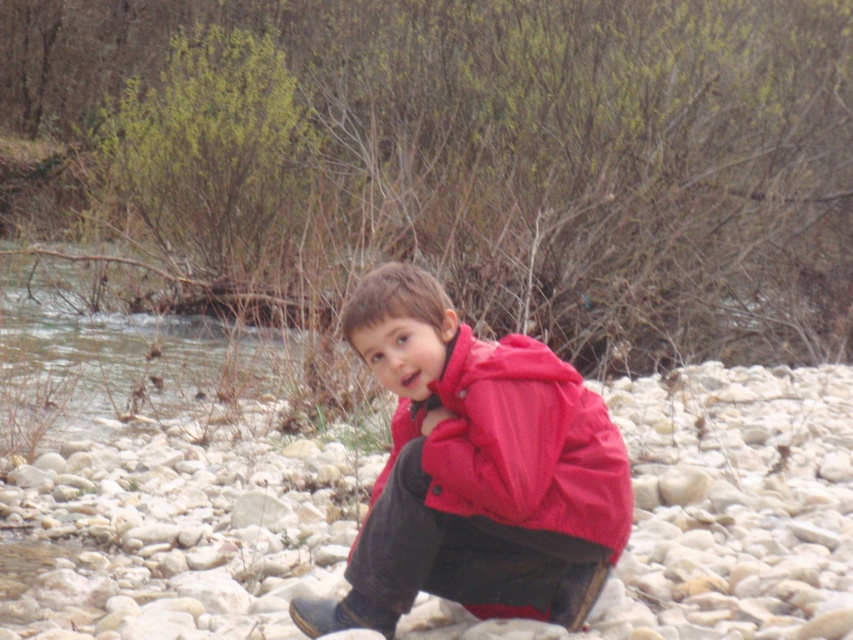
You are navigating a small drone through the scene shown in the image. You need to fly from point A to point B. If point A is at point (659, 448) and point B is at point (398, 451), will you fly over the child or stay above the pebbles?

Point (659, 448) is behind point (398, 451), so flying from point A to point B would mean moving forward towards the camera. Since the child is positioned on the pebbles near the stream, the path from the back to the front would pass above the pebbles and not over the child.

You are a photographer trying to capture a closeup of the smooth pebbles at center and the matte red jacket at center. Your camera can focus on objects within 10 feet. Will you be able to capture both subjects clearly in the same shot?

The smooth pebbles at center is 12.54 feet away from matte red jacket at center. Since the camera can only focus on objects within 10 feet, the distance between them exceeds the focus range, so you cannot capture both clearly in the same shot.